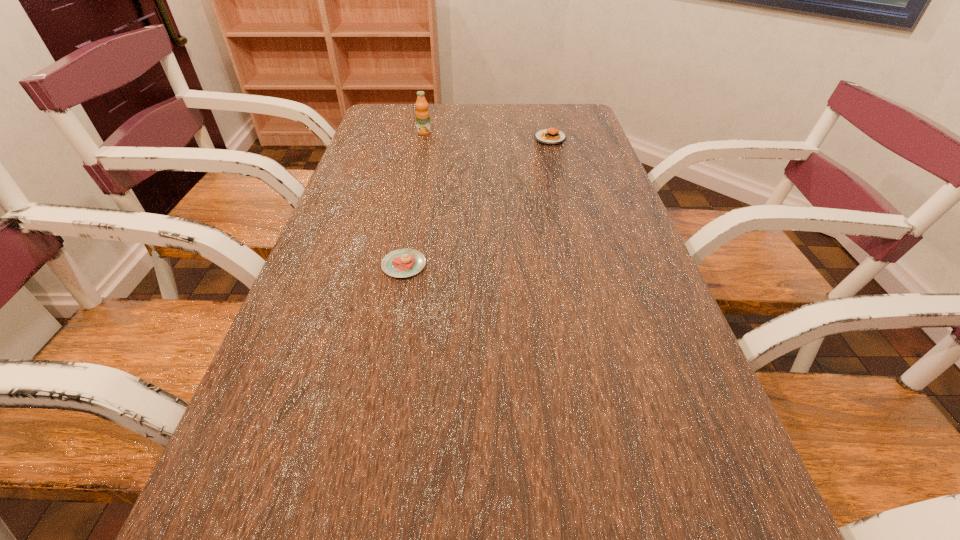
Locate an element on the screen. The height and width of the screenshot is (540, 960). free space that satisfies the following two spatial constraints: 1. on the label of the orange juice; 2. on the right side of the pastry is located at coordinates (396, 265).

At what (x,y) coordinates should I click in order to perform the action: click on vacant region that satisfies the following two spatial constraints: 1. on the label of the rightmost object; 2. on the right side of the tallest object. Please return your answer as a coordinate pair (x, y). Image resolution: width=960 pixels, height=540 pixels. Looking at the image, I should click on (423, 139).

Locate an element on the screen. The image size is (960, 540). free space that satisfies the following two spatial constraints: 1. on the label of the shortest object; 2. on the left side of the orange juice is located at coordinates (396, 265).

You are a GUI agent. You are given a task and a screenshot of the screen. Output one action in this format:
    pyautogui.click(x=<x>, y=<y>)
    Task: Click on the vacant area that satisfies the following two spatial constraints: 1. on the label of the tallest object; 2. on the left side of the second shortest object
    
    Given the screenshot: What is the action you would take?
    pyautogui.click(x=423, y=139)

Locate an element on the screen. free location that satisfies the following two spatial constraints: 1. on the label of the tallest object; 2. on the right side of the rightmost object is located at coordinates (423, 139).